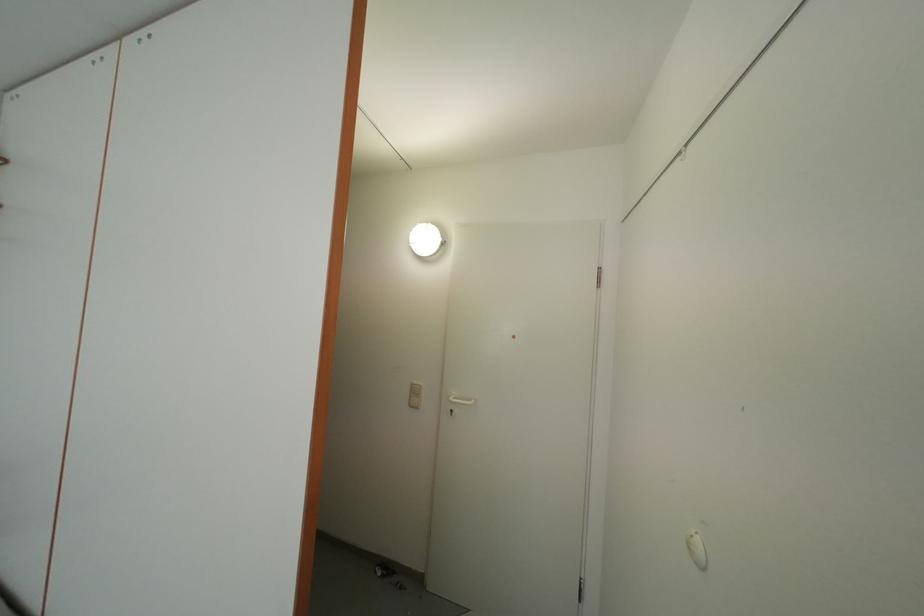
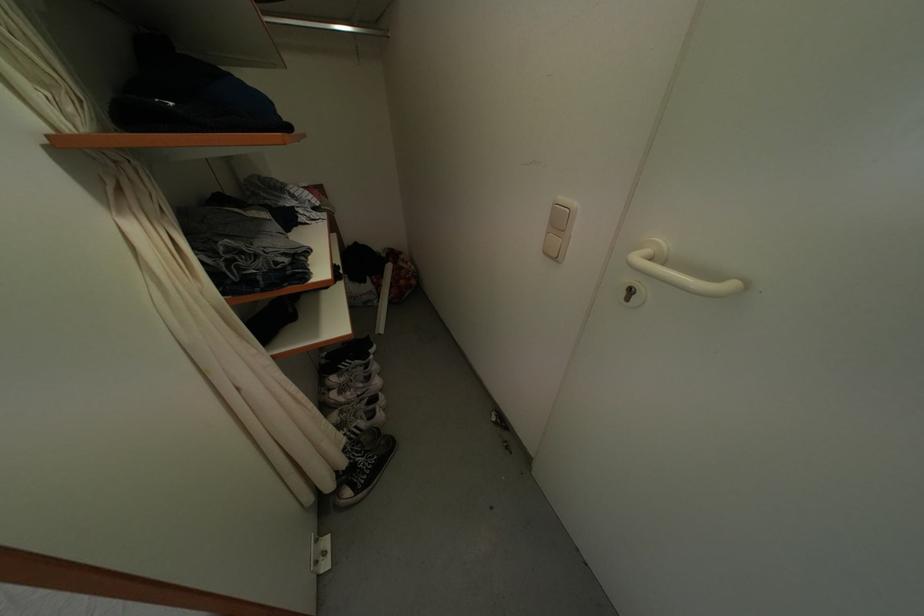
Locate, in the second image, the point that corresponds to pixel 421 398 in the first image.

(565, 228)